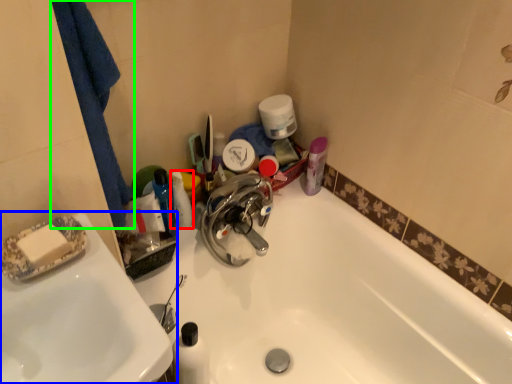
Question: Based on their relative distances, which object is farther from toiletry (highlighted by a red box)? Choose from sink (highlighted by a blue box) and bath towel (highlighted by a green box).

Choices:
 (A) sink
 (B) bath towel

Answer: (A)